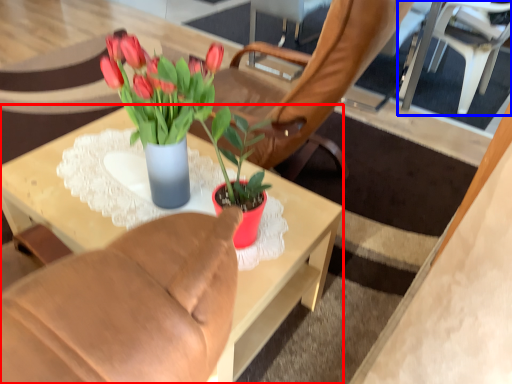
Question: Which point is closer to the camera, desk (highlighted by a red box) or chair (highlighted by a blue box)?

Choices:
 (A) desk
 (B) chair

Answer: (A)